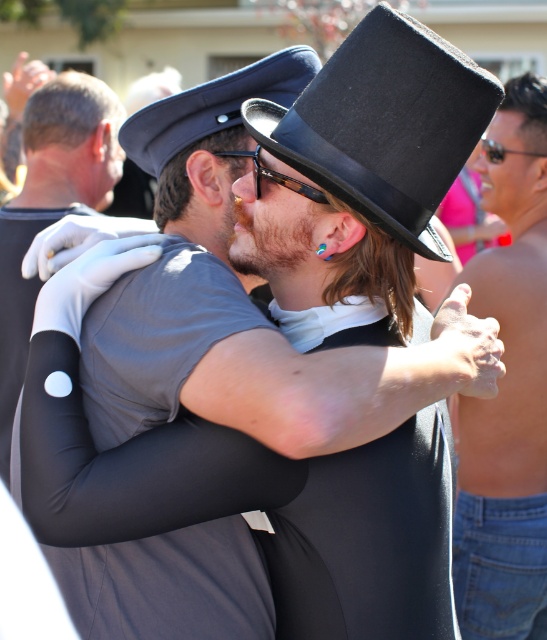
Question: Does shiny skin torso at right appear on the right side of blue fabric cap at upper center?

Choices:
 (A) no
 (B) yes

Answer: (B)

Question: Which of the following is the farthest from the observer?

Choices:
 (A) (428, 209)
 (B) (543, 257)

Answer: (B)

Question: Among these objects, which one is farthest from the camera?

Choices:
 (A) black leather dress hat at upper center
 (B) blue fabric cap at upper center
 (C) white matte glove at upper left
 (D) shiny skin torso at right

Answer: (C)

Question: Can you confirm if shiny skin torso at right is smaller than white matte glove at upper left?

Choices:
 (A) no
 (B) yes

Answer: (B)

Question: Where is shiny skin torso at right located in relation to white matte glove at upper left in the image?

Choices:
 (A) above
 (B) below

Answer: (B)

Question: Which object appears farthest from the camera in this image?

Choices:
 (A) shiny skin torso at right
 (B) blue fabric cap at upper center

Answer: (A)